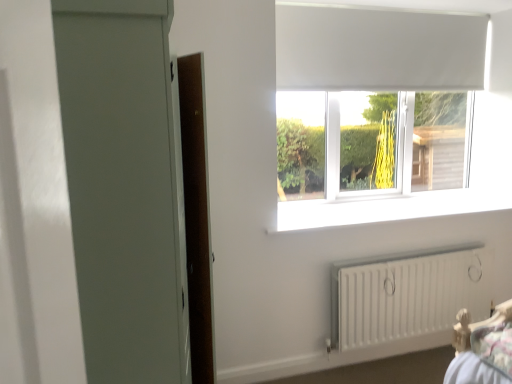
Question: Does white matte curtain at upper center have a greater width compared to white matte radiator at lower right?

Choices:
 (A) no
 (B) yes

Answer: (B)

Question: Is white matte curtain at upper center oriented away from white matte radiator at lower right?

Choices:
 (A) no
 (B) yes

Answer: (A)

Question: From a real-world perspective, is white matte curtain at upper center located higher than white matte radiator at lower right?

Choices:
 (A) no
 (B) yes

Answer: (B)

Question: Can you confirm if white matte curtain at upper center is taller than white matte radiator at lower right?

Choices:
 (A) no
 (B) yes

Answer: (B)

Question: From the image's perspective, is white matte curtain at upper center above white matte radiator at lower right?

Choices:
 (A) no
 (B) yes

Answer: (B)

Question: Is white matte curtain at upper center outside of white matte radiator at lower right?

Choices:
 (A) yes
 (B) no

Answer: (A)

Question: From a real-world perspective, is white matte radiator at lower right physically below white matte window at upper center?

Choices:
 (A) no
 (B) yes

Answer: (B)

Question: Is white matte radiator at lower right not close to white matte window at upper center?

Choices:
 (A) yes
 (B) no

Answer: (B)

Question: Does white matte radiator at lower right have a smaller size compared to white matte window at upper center?

Choices:
 (A) no
 (B) yes

Answer: (B)

Question: Is the depth of white matte radiator at lower right greater than that of white matte window at upper center?

Choices:
 (A) no
 (B) yes

Answer: (A)

Question: Does white matte radiator at lower right have a lesser width compared to white matte window at upper center?

Choices:
 (A) no
 (B) yes

Answer: (B)

Question: Is white matte radiator at lower right positioned before white matte window at upper center?

Choices:
 (A) yes
 (B) no

Answer: (A)

Question: Is white smooth window sill at center completely or partially outside of matte gray screen door at left?

Choices:
 (A) no
 (B) yes

Answer: (B)